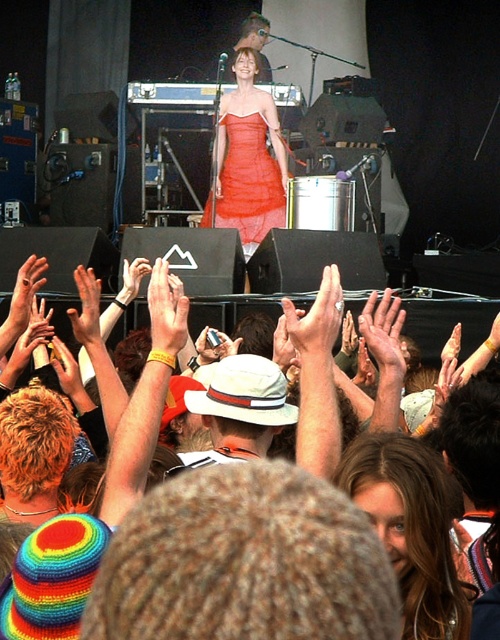
Looking at this image, you are a photographer at the concert. You want to capture a photo where both the translucent orange dress at center and the smooth skin hand at center are clearly visible. Which object should you focus on first to ensure both are in sharp focus?

The translucent orange dress at center is larger in size than the smooth skin hand at center, so you should focus on the translucent orange dress at center first to ensure both are in sharp focus.

You are a photographer at the concert. You want to capture a photo where the translucent orange dress at center is clearly visible above the matte white hand at center. Based on the scene description, can you achieve this?

The translucent orange dress at center has a greater height compared to the matte white hand at center, so yes, the dress will be visible above the hand in the photo.

You are a photographer at the concert and want to capture the performer in the translucent orange dress at center and the audience member with the matte white hand at center. From the performer, which direction should you move your camera to focus on the audience member?

The translucent orange dress at center is to the left of the matte white hand at center, so you should move your camera to the right to focus on the audience member.